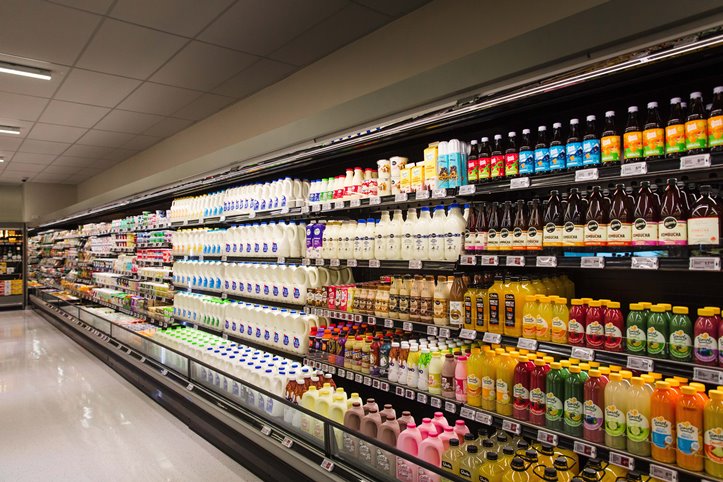
The image size is (723, 482). Identify the location of wall. (354, 83), (46, 195), (11, 204).